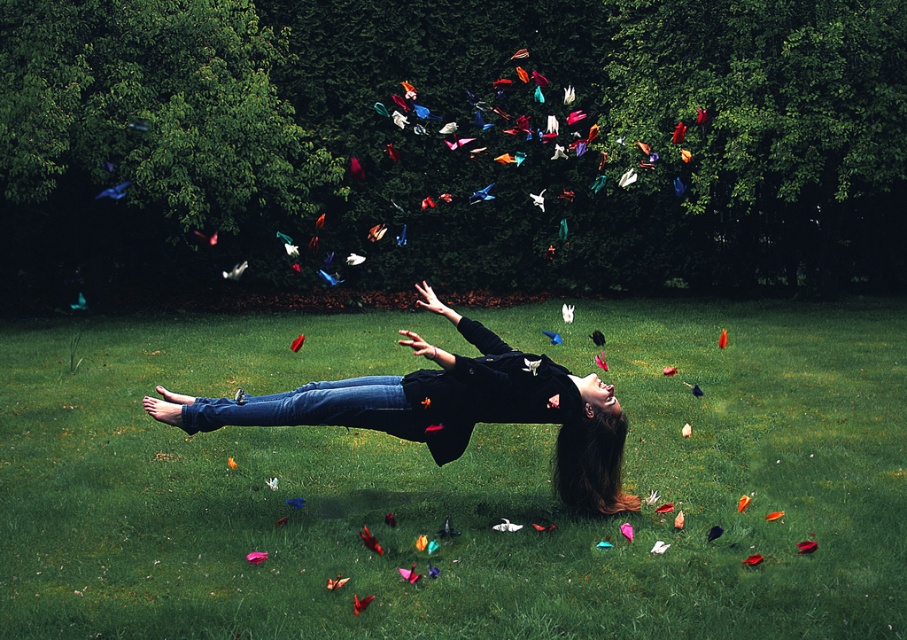
Question: Is green grass at center smaller than denim jeans at lower center?

Choices:
 (A) yes
 (B) no

Answer: (B)

Question: Which object appears closest to the camera in this image?

Choices:
 (A) denim jeans at lower center
 (B) matte black jacket at center

Answer: (B)

Question: Is matte black jacket at center above denim jeans at lower center?

Choices:
 (A) yes
 (B) no

Answer: (A)

Question: Which of the following is the closest to the observer?

Choices:
 (A) denim jeans at lower center
 (B) matte black jacket at center
 (C) green grass at center

Answer: (C)

Question: Which of the following is the farthest from the observer?

Choices:
 (A) denim jeans at lower center
 (B) matte black jacket at center

Answer: (A)

Question: Observing the image, what is the correct spatial positioning of matte black jacket at center in reference to denim jeans at lower center?

Choices:
 (A) above
 (B) below

Answer: (A)